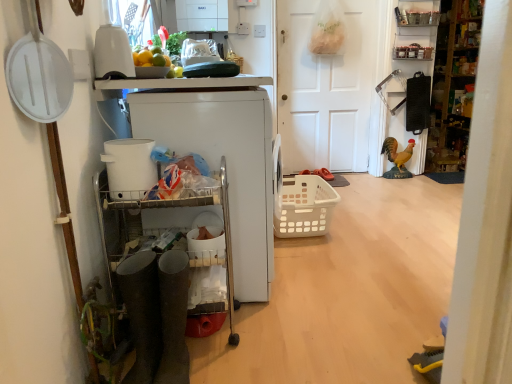
The height and width of the screenshot is (384, 512). In order to click on vacant space in between yellow matte rooster at right and white plastic basket at center in this screenshot , I will do `click(366, 202)`.